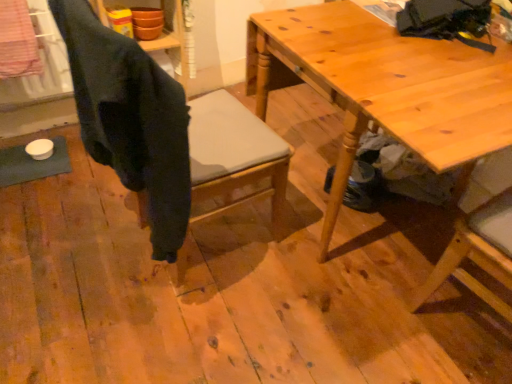
Find the location of `vacant space in dark gray fabric chair at center (from a real-world perspective)`. vacant space in dark gray fabric chair at center (from a real-world perspective) is located at coordinates (205, 241).